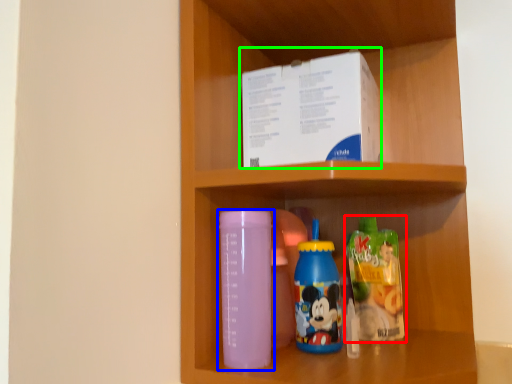
Question: Which object is the farthest from bottle (highlighted by a red box)? Choose among these: bottle (highlighted by a blue box) or box (highlighted by a green box).

Choices:
 (A) bottle
 (B) box

Answer: (B)